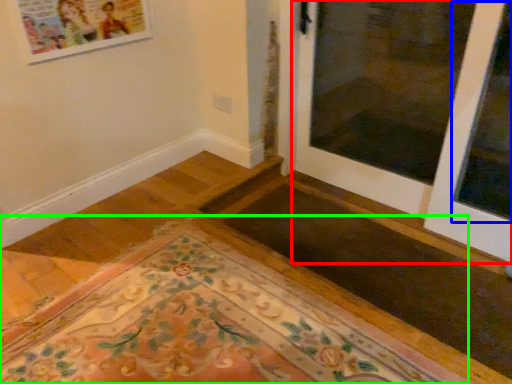
Question: Based on their relative distances, which object is farther from door (highlighted by a red box)? Choose from window (highlighted by a blue box) and mat (highlighted by a green box).

Choices:
 (A) window
 (B) mat

Answer: (B)